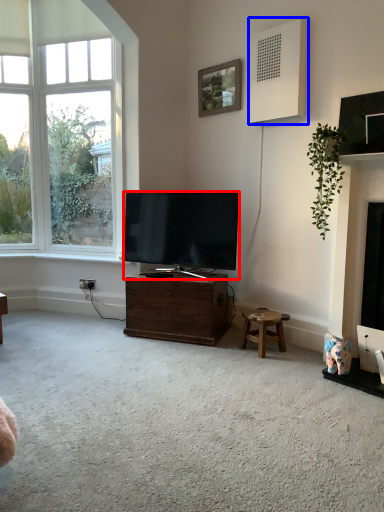
Question: Which object appears farthest to the camera in this image, television (highlighted by a red box) or speaker (highlighted by a blue box)?

Choices:
 (A) television
 (B) speaker

Answer: (A)